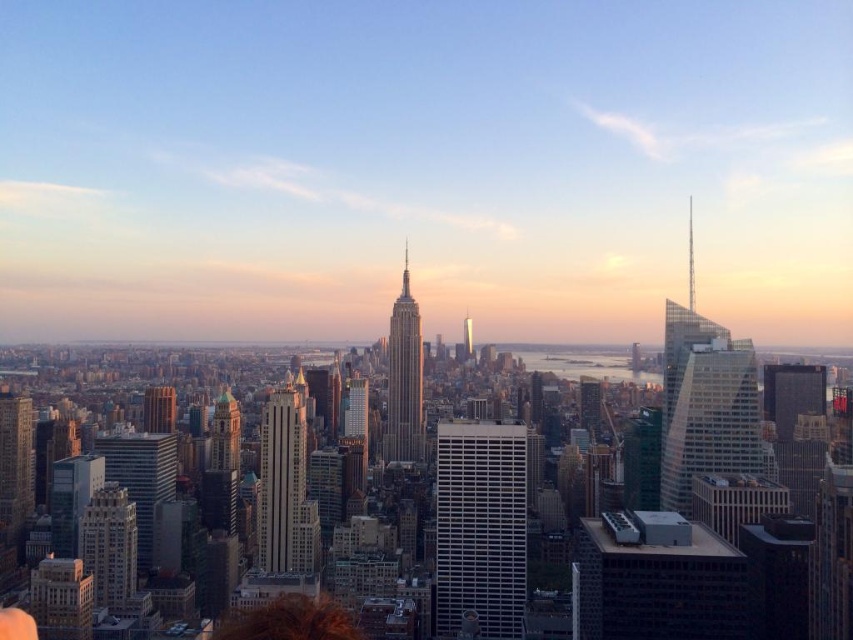
Question: Is the position of matte glass skyscraper at center more distant than that of shiny silver skyscraper at center?

Choices:
 (A) yes
 (B) no

Answer: (A)

Question: Does clear glass skyscraper at right have a lesser width compared to gold textured building at lower left?

Choices:
 (A) yes
 (B) no

Answer: (B)

Question: Does smooth glass skyscraper at center have a greater width compared to gold reflective tower at center?

Choices:
 (A) no
 (B) yes

Answer: (B)

Question: Which object appears farthest from the camera in this image?

Choices:
 (A) shiny silver skyscraper at center
 (B) smooth glass skyscraper at center

Answer: (B)

Question: Among these objects, which one is nearest to the camera?

Choices:
 (A) smooth glass skyscraper at center
 (B) brown hair at center

Answer: (A)

Question: Which point is farther to the camera?

Choices:
 (A) matte glass skyscraper at center
 (B) white glass building at center
 (C) shiny silver skyscraper at center
 (D) gold reflective tower at center

Answer: (A)